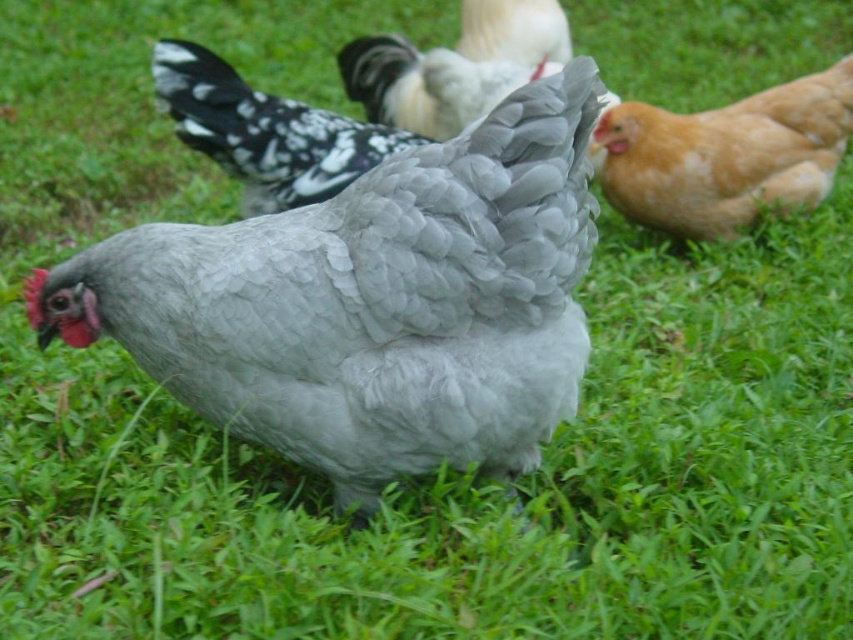
You are a farmer observing the chickens in your coop. You notice the gray feathered chicken at center and the white speckled feathers at center. Which chicken is taller?

The gray feathered chicken at center is taller than the white speckled feathers at center.

You are standing in a chicken coop and see the golden feathered chicken at right. If you want to throw a seed to it, and your throwing range is 3 meters, will you be able to reach it?

The golden feathered chicken at right is 3.43 meters away from the viewer, which exceeds your throwing range of 3 meters. Therefore, you cannot reach it with your current range.

You are a farmer checking the location of your chickens in the coop. You see the gray feathered chicken at center. Can you confirm if the point at coordinates (370, 301) is where the gray feathered chicken at center is located?

Yes, the point at coordinates (370, 301) corresponds to the gray feathered chicken at center, so it is located there.